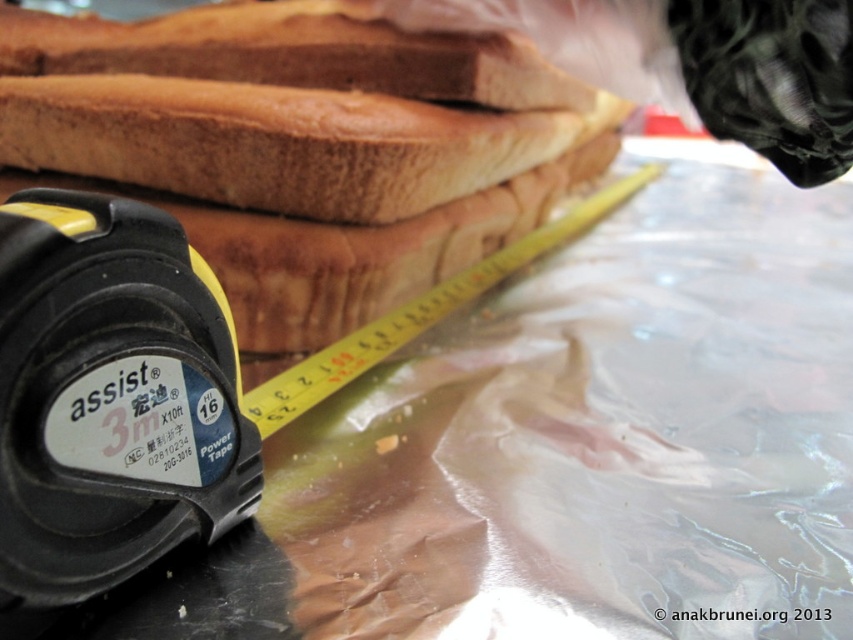
Question: Does yellow plastic tape measure at lower left come behind black rubber tape measure at lower left?

Choices:
 (A) no
 (B) yes

Answer: (B)

Question: Which point is farther to the camera?

Choices:
 (A) yellow plastic tape measure at lower left
 (B) golden brown bread at center
 (C) black rubber tape measure at lower left

Answer: (B)

Question: From the image, what is the correct spatial relationship of black rubber tape measure at lower left in relation to golden brown bread at center?

Choices:
 (A) left
 (B) right

Answer: (A)

Question: Which of the following is the closest to the observer?

Choices:
 (A) golden brown bread at center
 (B) black rubber tape measure at lower left
 (C) yellow/yellowish plastic tape measure at upper center

Answer: (B)

Question: Among these points, which one is farthest from the camera?

Choices:
 (A) (372, 140)
 (B) (175, 467)
 (C) (450, 291)
 (D) (367, 90)

Answer: (C)

Question: Does black rubber tape measure at lower left appear over golden brown bread at center?

Choices:
 (A) no
 (B) yes

Answer: (A)